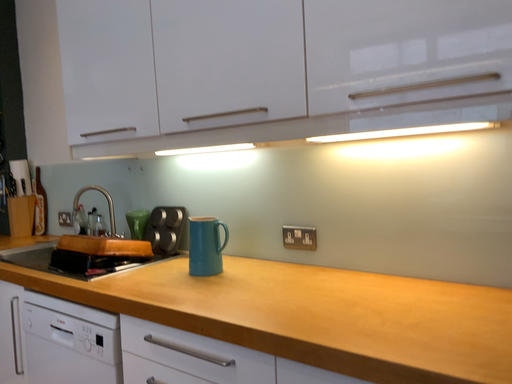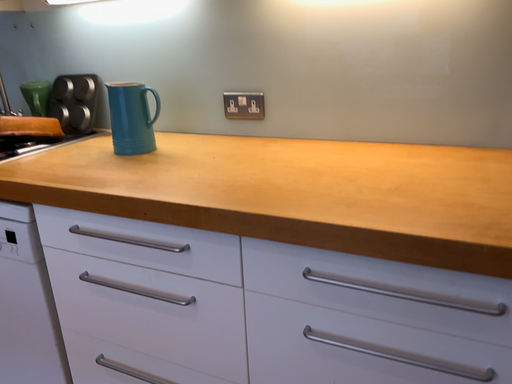
Question: Which way did the camera rotate in the video?

Choices:
 (A) rotated downward
 (B) rotated upward

Answer: (A)